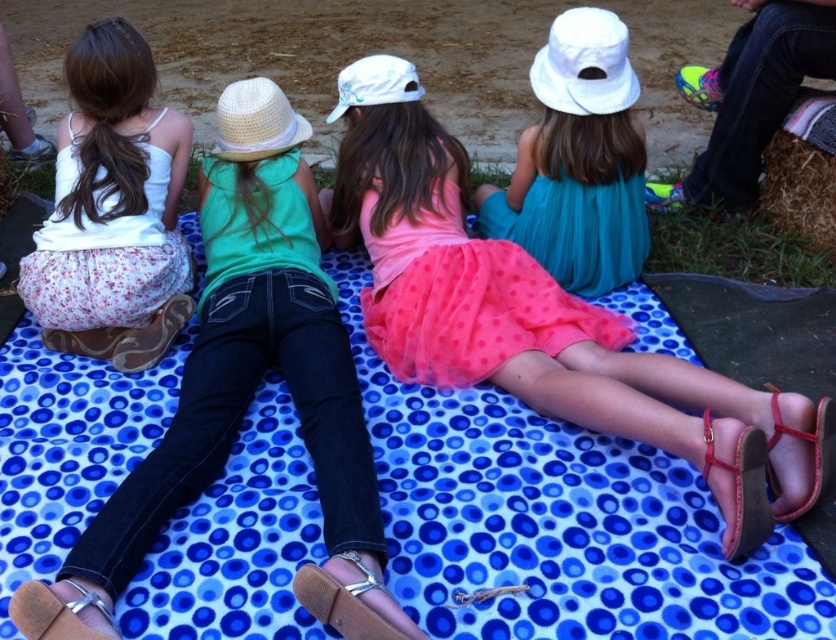
Question: Which of the following is the farthest from the observer?

Choices:
 (A) pink tulle skirt at center
 (B) blue dotted fabric at center

Answer: (A)

Question: Can you confirm if brown leather sandal at lower center is positioned to the left of brown leather sandal at lower right?

Choices:
 (A) yes
 (B) no

Answer: (A)

Question: Which point is closer to the camera taking this photo?

Choices:
 (A) (334, 362)
 (B) (752, 488)
 (C) (822, 406)

Answer: (B)

Question: Which of the following is the closest to the observer?

Choices:
 (A) brown leather sandal at lower center
 (B) white floral skirt at left
 (C) brown leather sandal at lower left
 (D) pink tulle skirt at center

Answer: (A)

Question: Does blue dotted fabric at center have a lesser width compared to brown leather sandal at lower left?

Choices:
 (A) yes
 (B) no

Answer: (B)

Question: Does white denim jeans at center appear on the right side of white floral skirt at left?

Choices:
 (A) yes
 (B) no

Answer: (A)